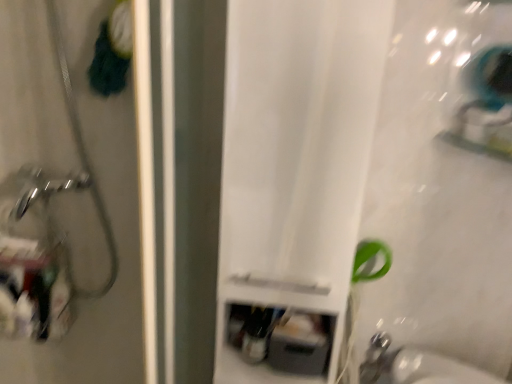
Question: Would you say satin nickel faucet at lower right is to the left or to the right of brushed metal showerhead at left in the picture?

Choices:
 (A) right
 (B) left

Answer: (A)

Question: Considering the positions of satin nickel faucet at lower right and brushed metal showerhead at left in the image, is satin nickel faucet at lower right bigger or smaller than brushed metal showerhead at left?

Choices:
 (A) small
 (B) big

Answer: (A)

Question: Based on their relative distances, which object is farther from the satin nickel faucet at lower right?

Choices:
 (A) white matte curtain at center
 (B) brushed metal showerhead at left

Answer: (B)

Question: Estimate the real-world distances between objects in this image. Which object is farther from the satin nickel faucet at lower right?

Choices:
 (A) brushed metal showerhead at left
 (B) white matte curtain at center

Answer: (A)